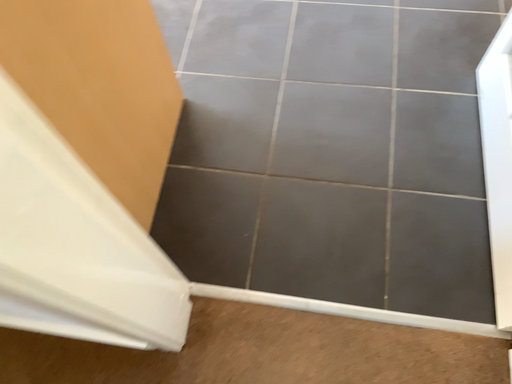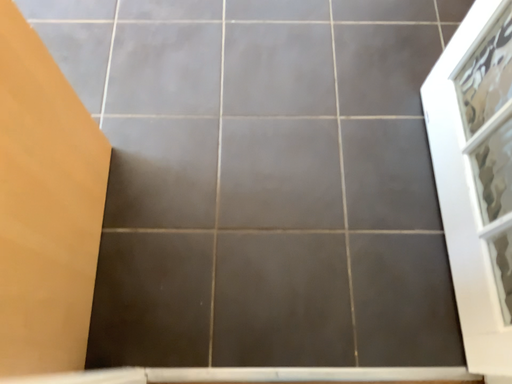
Question: How did the camera likely rotate when shooting the video?

Choices:
 (A) rotated left
 (B) rotated right

Answer: (B)